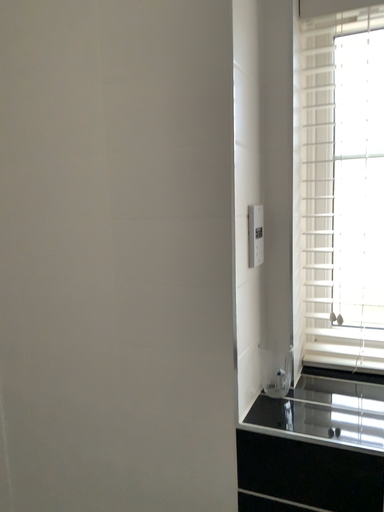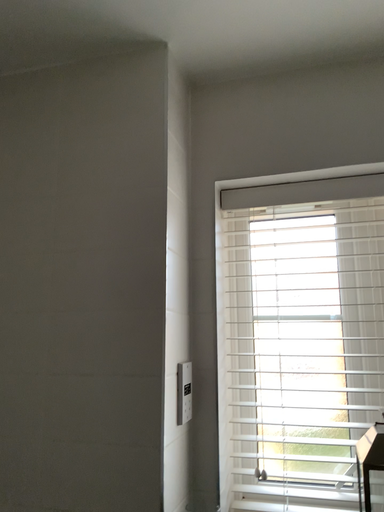
Question: How did the camera likely rotate when shooting the video?

Choices:
 (A) rotated left
 (B) rotated right

Answer: (B)